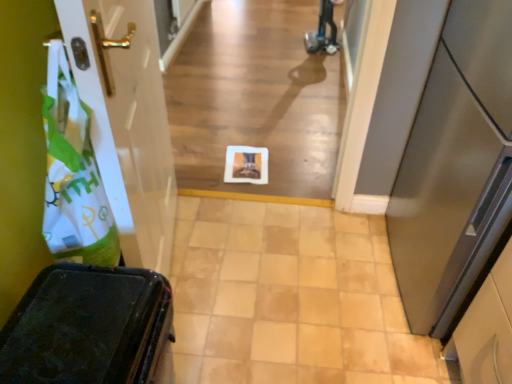
You are a GUI agent. You are given a task and a screenshot of the screen. Output one action in this format:
    pyautogui.click(x=<x>, y=<y>)
    Task: Click on the spots to the right of white glossy door at left, placed as the 2th door when sorted from right to left
    
    Given the screenshot: What is the action you would take?
    pyautogui.click(x=269, y=268)